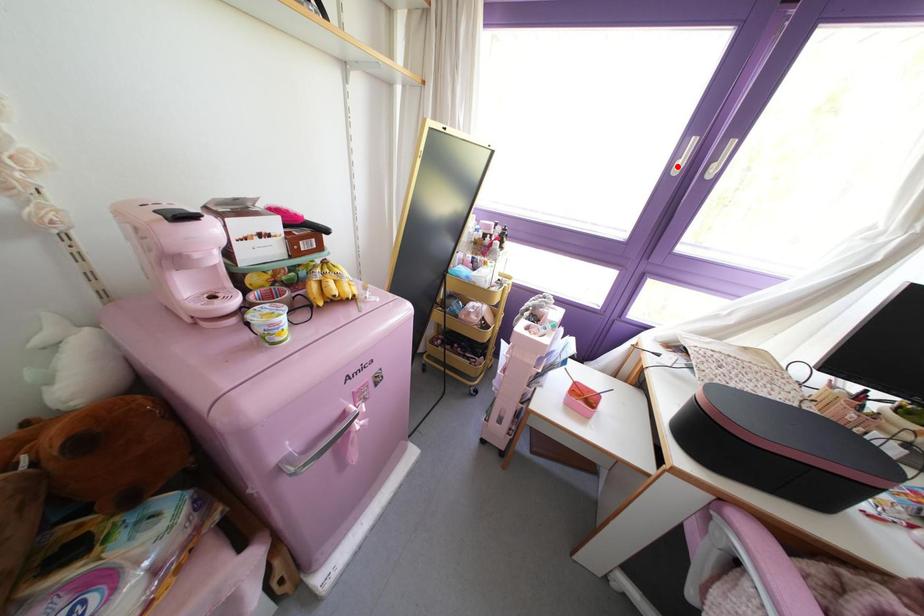
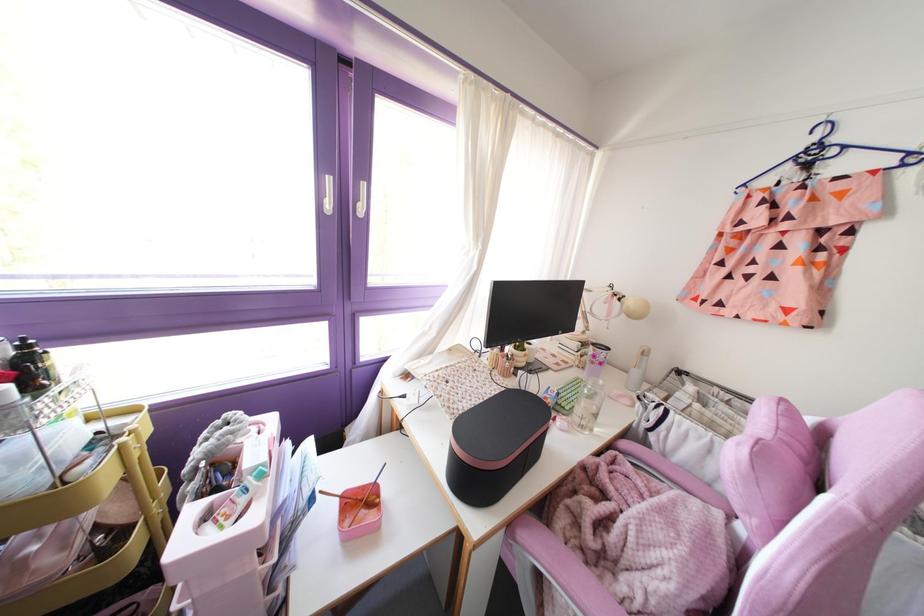
Find the pixel in the second image that matches the highlighted location in the first image.

(329, 205)